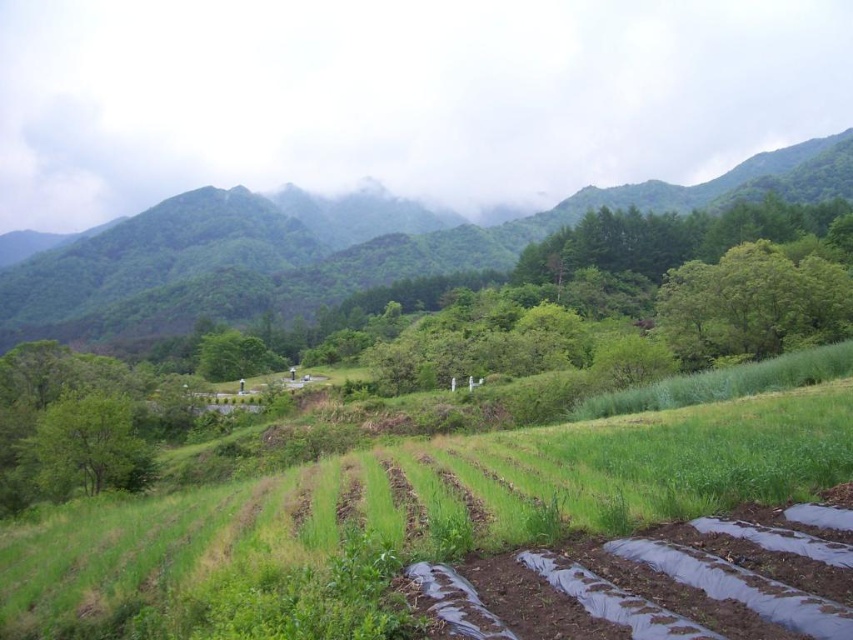
Does green grass at center appear on the right side of green leafy tree at center?

Yes, green grass at center is to the right of green leafy tree at center.

Who is shorter, green grass at center or green leafy tree at center?

Standing shorter between the two is green grass at center.

What do you see at coordinates (399, 518) in the screenshot?
I see `green grass at center` at bounding box center [399, 518].

Find the location of a particular element. The image size is (853, 640). green grass at center is located at coordinates (399, 518).

Looking at this image, is green grass at center smaller than green grassy hillside at upper center?

Indeed, green grass at center has a smaller size compared to green grassy hillside at upper center.

Who is taller, green grass at center or green grassy hillside at upper center?

green grassy hillside at upper center

At what (x,y) coordinates should I click in order to perform the action: click on green grass at center. Please return your answer as a coordinate pair (x, y). The height and width of the screenshot is (640, 853). Looking at the image, I should click on (399, 518).

What do you see at coordinates (85, 445) in the screenshot?
I see `green leafy tree at left` at bounding box center [85, 445].

Between green leafy tree at left and green leafy tree at center, which one is positioned lower?

green leafy tree at left is below.

At what (x,y) coordinates should I click in order to perform the action: click on green leafy tree at left. Please return your answer as a coordinate pair (x, y). This screenshot has height=640, width=853. Looking at the image, I should click on click(85, 445).

I want to click on green leafy tree at left, so click(x=85, y=445).